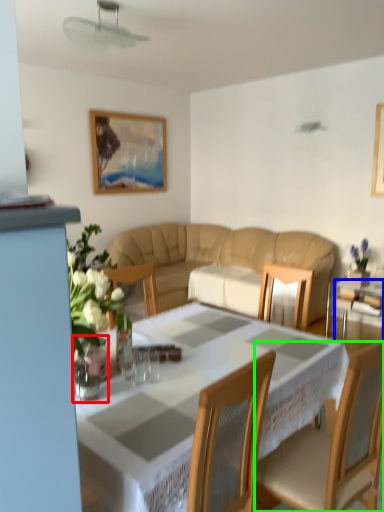
Question: Estimate the real-world distances between objects in this image. Which object is farther from glass vase (highlighted by a red box), glass table (highlighted by a blue box) or chair (highlighted by a green box)?

Choices:
 (A) glass table
 (B) chair

Answer: (A)